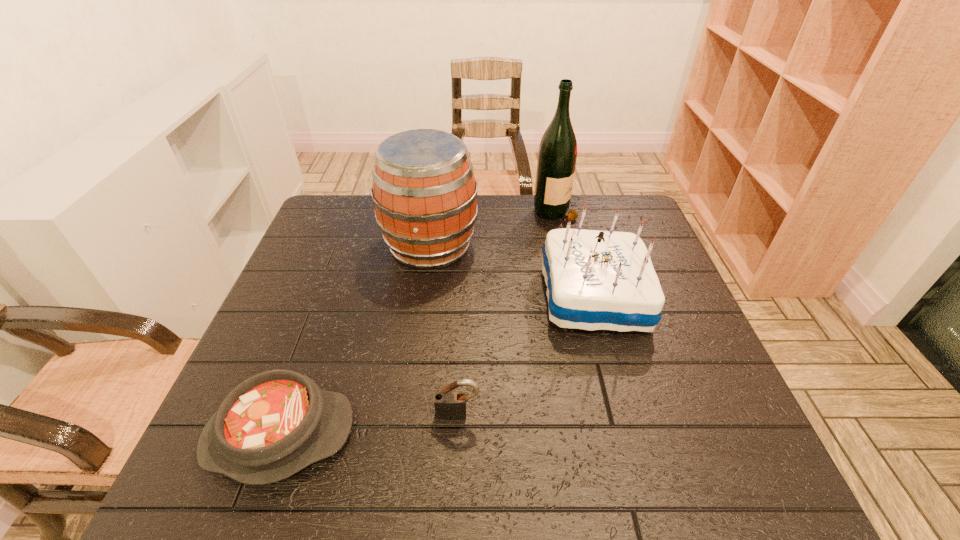
Where is `the tallest object`? Image resolution: width=960 pixels, height=540 pixels. the tallest object is located at coordinates (557, 154).

Identify the location of the second tallest object. (424, 191).

Where is `the third tallest object`? The height and width of the screenshot is (540, 960). the third tallest object is located at coordinates coord(596,280).

Locate an element on the screen. This screenshot has height=540, width=960. padlock is located at coordinates (449, 405).

Locate an element on the screen. the shortest object is located at coordinates (274, 424).

Identify the location of vacant point located 0.370m on the front of the wine bottle. (580, 309).

Locate an element on the screen. This screenshot has width=960, height=540. free space located on the front of the cider is located at coordinates (424, 292).

Locate an element on the screen. The height and width of the screenshot is (540, 960). vacant point located on the left of the third shortest object is located at coordinates (410, 297).

I want to click on free location located with the keyhole on the front of the fourth tallest object, so click(455, 487).

Find the location of a particular element. The height and width of the screenshot is (540, 960). vacant region located on the right of the casserole is located at coordinates (534, 435).